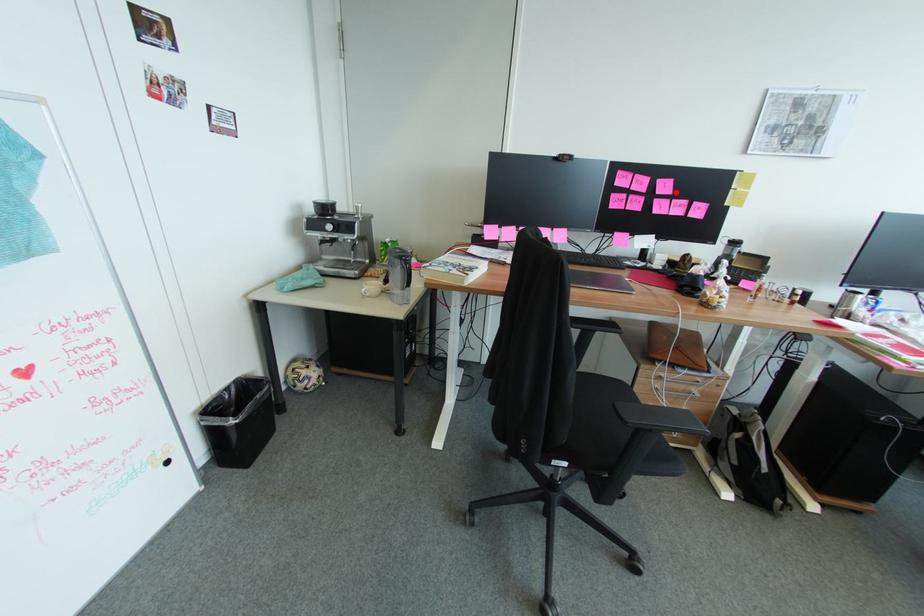
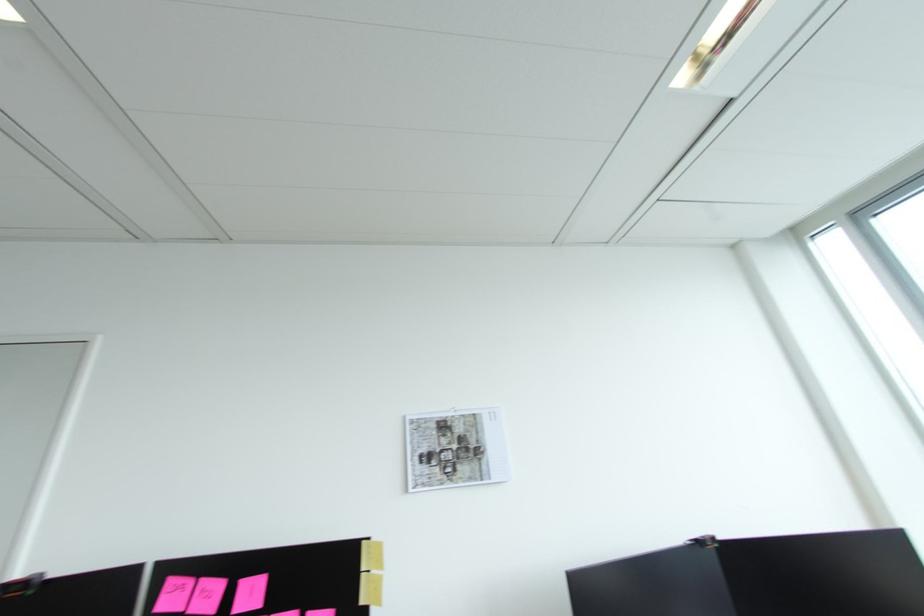
Locate, in the second image, the point that corresponds to the highlighted location in the first image.

(262, 605)